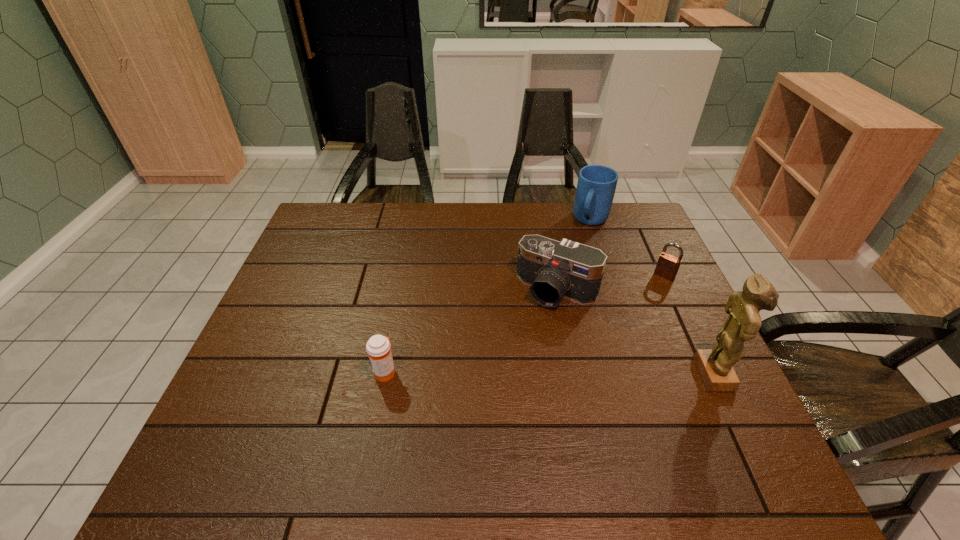
The height and width of the screenshot is (540, 960). In order to click on object present at the far right corner in this screenshot , I will do `click(596, 186)`.

Find the location of a particular element. This screenshot has height=540, width=960. free region at the far edge of the desktop is located at coordinates pos(425,233).

The height and width of the screenshot is (540, 960). I want to click on free space at the near edge, so click(x=549, y=418).

In the image, there is a desktop. At what (x,y) coordinates should I click in order to perform the action: click on vacant space at the right edge. Please return your answer as a coordinate pair (x, y). Looking at the image, I should click on (685, 305).

Locate an element on the screen. The width and height of the screenshot is (960, 540). free spot at the far left corner of the desktop is located at coordinates (314, 234).

Where is `blank area at the near left corner`? This screenshot has height=540, width=960. blank area at the near left corner is located at coordinates (296, 401).

I want to click on free region at the far right corner of the desktop, so click(612, 221).

At what (x,y) coordinates should I click in order to perform the action: click on vacant space in between the figurine and the padlock. Please return your answer as a coordinate pair (x, y). The height and width of the screenshot is (540, 960). Looking at the image, I should click on (690, 325).

Image resolution: width=960 pixels, height=540 pixels. Identify the location of unoccupied position between the padlock and the leftmost object. (524, 323).

You are a GUI agent. You are given a task and a screenshot of the screen. Output one action in this format:
    pyautogui.click(x=<x>, y=<y>)
    Task: Click on the vacant area that lies between the leftmost object and the padlock
    The height and width of the screenshot is (540, 960).
    Given the screenshot: What is the action you would take?
    pyautogui.click(x=524, y=323)